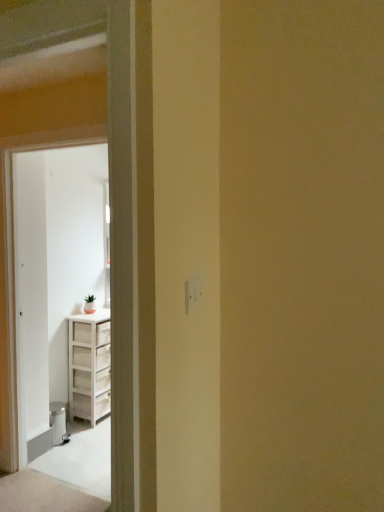
Question: Looking at the image, does white wood cabinet at left seem bigger or smaller compared to white wood screen door at left?

Choices:
 (A) big
 (B) small

Answer: (A)

Question: Is point (19, 426) closer or farther from the camera than point (21, 357)?

Choices:
 (A) closer
 (B) farther

Answer: (B)

Question: Visually, is white wood cabinet at left positioned to the left or to the right of white wood screen door at left?

Choices:
 (A) left
 (B) right

Answer: (B)

Question: Considering the relative positions of white wood screen door at left and white wood cabinet at left in the image provided, is white wood screen door at left to the left or to the right of white wood cabinet at left?

Choices:
 (A) left
 (B) right

Answer: (A)

Question: From a real-world perspective, is white wood screen door at left positioned above or below white wood cabinet at left?

Choices:
 (A) above
 (B) below

Answer: (B)

Question: Is point (41, 233) positioned closer to the camera than point (49, 172)?

Choices:
 (A) farther
 (B) closer

Answer: (B)

Question: Considering their positions, is white wood screen door at left located in front of or behind white wood cabinet at left?

Choices:
 (A) behind
 (B) front

Answer: (A)